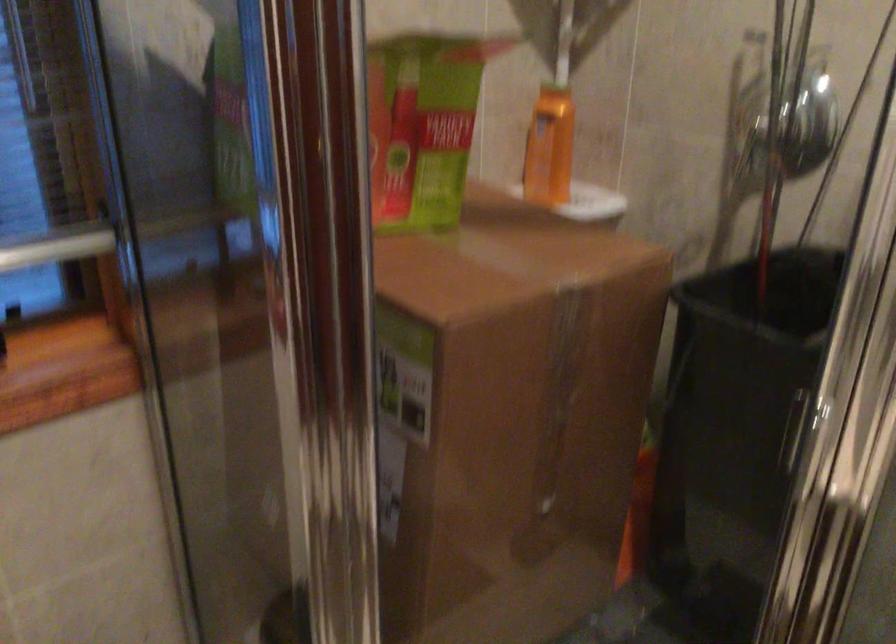
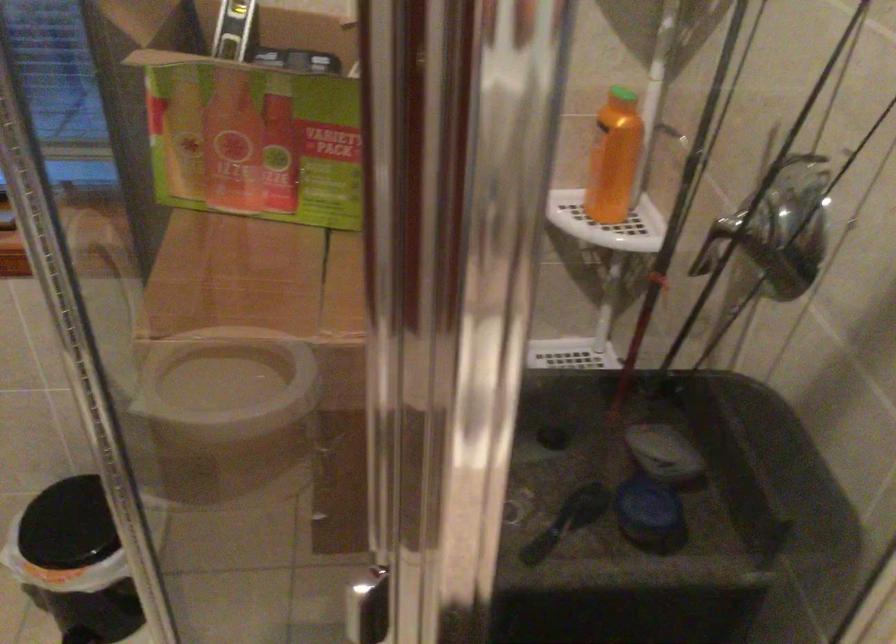
Where in the second image is the point corresponding to (x=561, y=143) from the first image?

(614, 158)